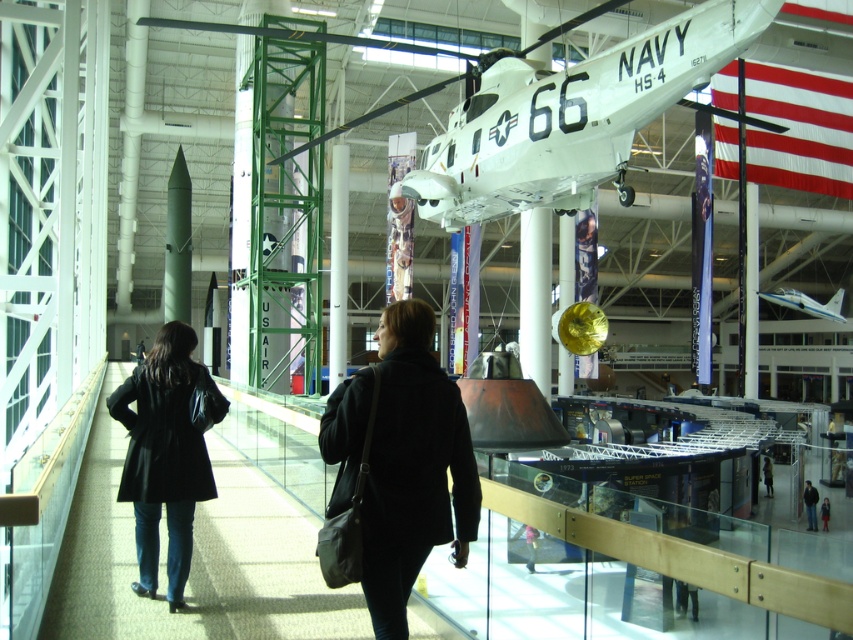
Who is positioned more to the right, dark blue jacket at lower right or dark blue coat at lower right?

dark blue coat at lower right

Does dark blue jacket at lower right have a greater width compared to dark blue coat at lower right?

Correct, the width of dark blue jacket at lower right exceeds that of dark blue coat at lower right.

Is point (808, 486) positioned behind point (827, 509)?

Yes, it is behind point (827, 509).

In order to click on dark blue jacket at lower right in this screenshot , I will do `click(810, 504)`.

Does black fabric coat at center appear on the left side of dark blue coat at center?

Correct, you'll find black fabric coat at center to the left of dark blue coat at center.

Which of these two, black fabric coat at center or dark blue coat at center, stands taller?

black fabric coat at center

Measure the distance between black fabric coat at center and camera.

14.71 feet

The image size is (853, 640). What are the coordinates of `black fabric coat at center` in the screenshot? It's located at (413, 467).

Can you confirm if black leather coat at lower left is positioned above light blue plastic airplane at center?

No.

Does black leather coat at lower left have a greater width compared to light blue plastic airplane at center?

No, black leather coat at lower left is not wider than light blue plastic airplane at center.

Who is more distant from viewer, (113, 397) or (827, 308)?

Point (827, 308)

The height and width of the screenshot is (640, 853). What are the coordinates of `black leather coat at lower left` in the screenshot? It's located at (164, 454).